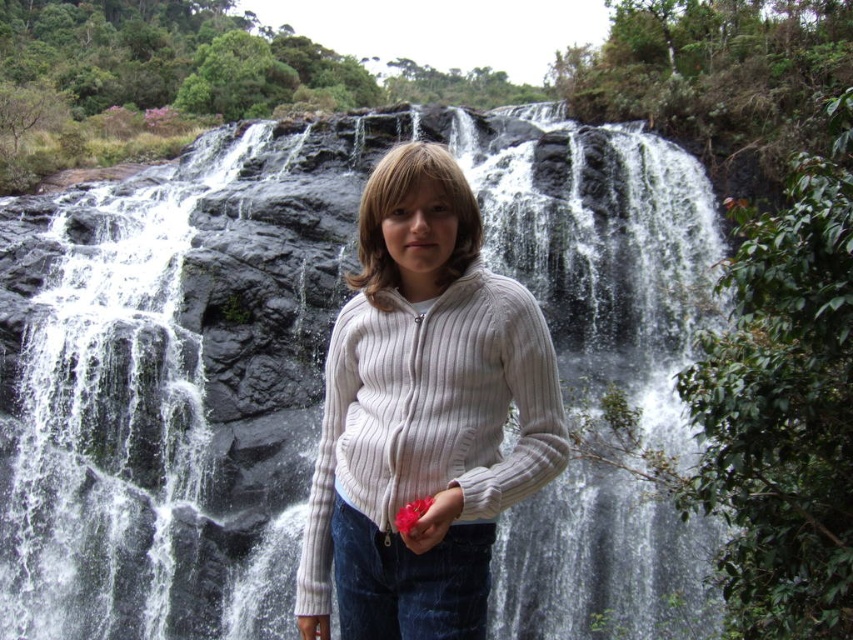
Is gray rock waterfall at center shorter than white ribbed sweater at center?

No.

Between gray rock waterfall at center and white ribbed sweater at center, which one is positioned lower?

white ribbed sweater at center

Locate an element on the screen. This screenshot has width=853, height=640. gray rock waterfall at center is located at coordinates (169, 388).

Is white ribbed sweater at center smaller than matte pink flower at center?

No.

Who is lower down, white ribbed sweater at center or matte pink flower at center?

Positioned lower is matte pink flower at center.

Is point (367, 294) more distant than point (450, 499)?

Yes, point (367, 294) is farther from viewer.

This screenshot has height=640, width=853. I want to click on white ribbed sweater at center, so click(422, 410).

Is gray rock waterfall at center in front of matte pink flower at center?

No, it is behind matte pink flower at center.

Consider the image. Can you confirm if gray rock waterfall at center is positioned below matte pink flower at center?

Actually, gray rock waterfall at center is above matte pink flower at center.

Measure the distance between point (653,561) and camera.

Point (653,561) and camera are 21.53 meters apart from each other.

Identify the location of gray rock waterfall at center. The height and width of the screenshot is (640, 853). (169, 388).